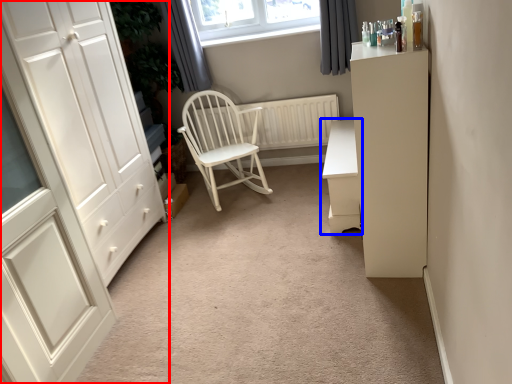
Question: Among these objects, which one is farthest to the camera, cupboard (highlighted by a red box) or chest of drawers (highlighted by a blue box)?

Choices:
 (A) cupboard
 (B) chest of drawers

Answer: (B)